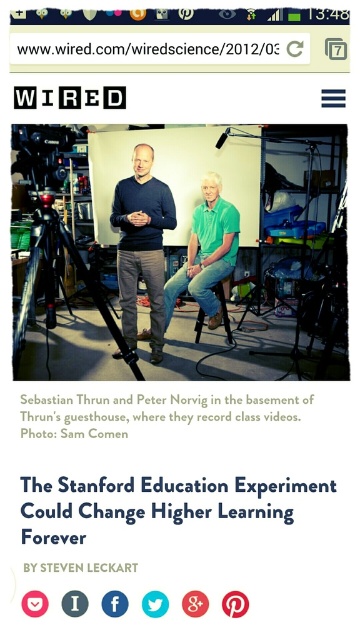
You are a photographer trying to capture a closeup of the white paper at center and the green cotton shirt at center in the Wired Science article screenshot. Based on their positions, which object should you focus on first to ensure both are in frame without moving the camera?

The green cotton shirt at center should be focused on first since the white paper at center is located below it, allowing the photographer to frame both by centering on the shirt and ensuring the paper remains in the lower part of the frame.

You are a photographer setting up equipment in a studio. You have a white paper at center and a matte black tripod at center. Which object is closer to the camera lens?

The white paper at center is closer to the camera lens because it is in front of the matte black tripod at center.